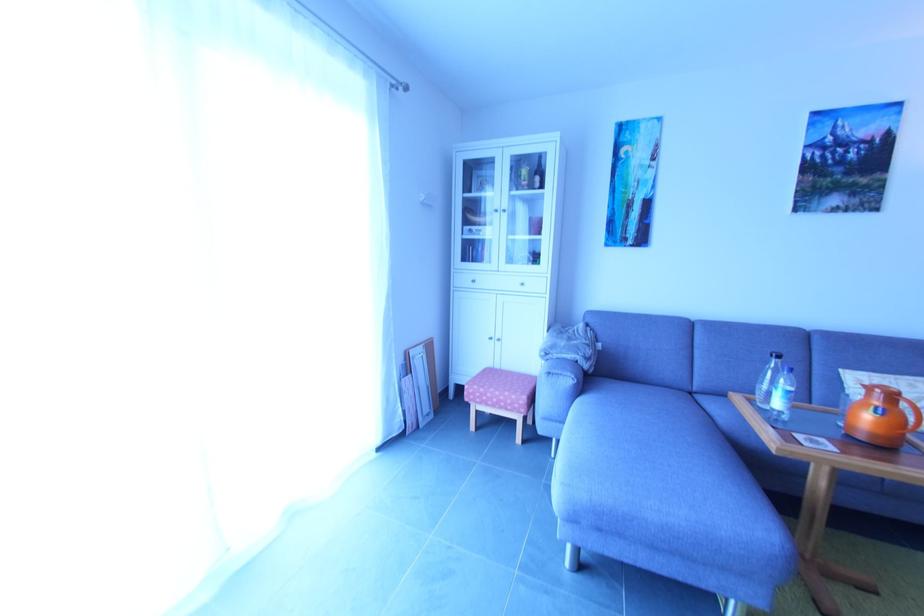
This screenshot has width=924, height=616. I want to click on leaning picture frame, so click(422, 378).